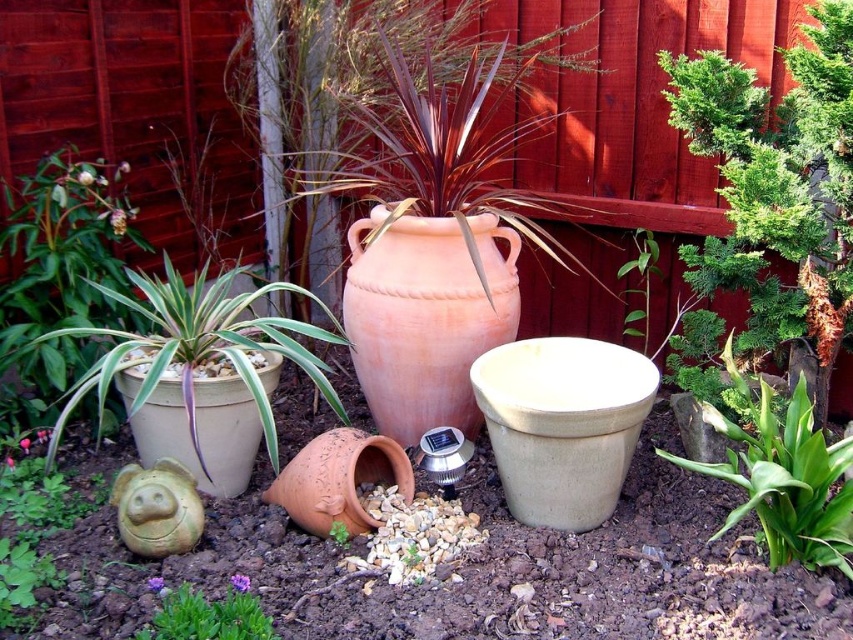
In the garden scene, there is a terracotta clay pot at center and a green matte succulent at center. Which object is positioned higher in the image?

The terracotta clay pot at center is positioned higher than the green matte succulent at center according to the description.

Based on the photo, you are standing in the garden scene described. You need to place a new decorative item exactly at point coordinates of 0.5, 0.5. Is the matte ceramic pig at lower left currently blocking that spot?

A: The matte ceramic pig at lower left is located at point coordinates of (202, 426), which is not the same as the desired (426, 320) coordinates. Therefore, the matte ceramic pig at lower left is not blocking that spot.

You are a gardener who wants to place a new small plant between the matte ceramic pig at lower left and the purple matte plant at lower left. Can you fit it there?

The matte ceramic pig at lower left might be wider than the purple matte plant at lower left, so there may not be enough space between them to fit the new small plant.